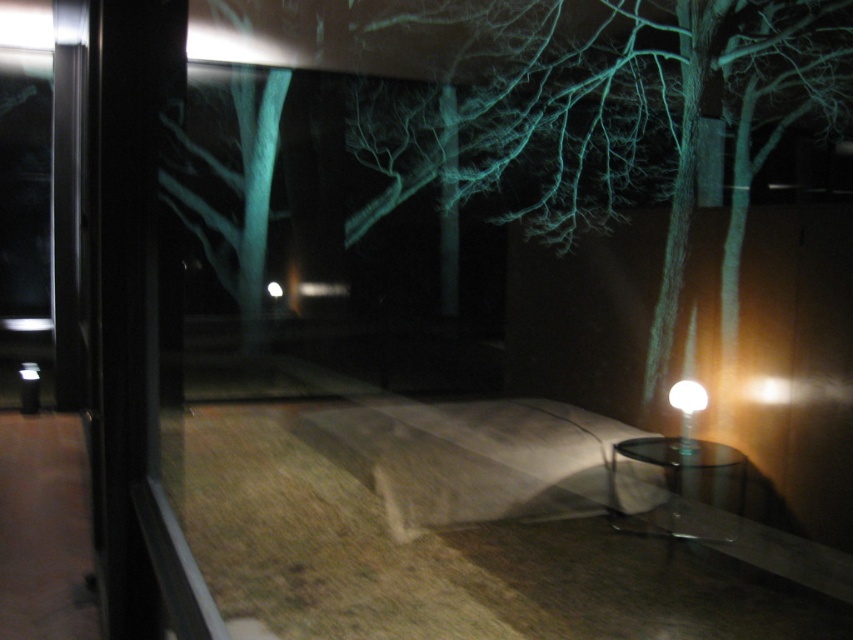
Who is lower down, white glossy lamp at right or white glossy light at lower right?

white glossy lamp at right

Which is above, white glossy lamp at right or white glossy light at lower right?

Positioned higher is white glossy light at lower right.

Measure the distance between white glossy lamp at right and camera.

white glossy lamp at right is 4.58 meters away from camera.

Identify the location of white glossy lamp at right. The height and width of the screenshot is (640, 853). (688, 412).

Between green translucent tree at upper center and white glossy light at lower right, which one has more height?

green translucent tree at upper center

Is point (729, 1) more distant than point (675, 394)?

Yes, point (729, 1) is behind point (675, 394).

Does point (640, 83) lie behind point (695, 392)?

Yes, it is.

Where is `green translucent tree at upper center`? This screenshot has height=640, width=853. green translucent tree at upper center is located at coordinates (618, 113).

Does green translucent tree at upper center have a lesser width compared to white glossy lamp at right?

In fact, green translucent tree at upper center might be wider than white glossy lamp at right.

Is green translucent tree at upper center behind white glossy lamp at right?

Yes.

Locate an element on the screen. green translucent tree at upper center is located at coordinates (618, 113).